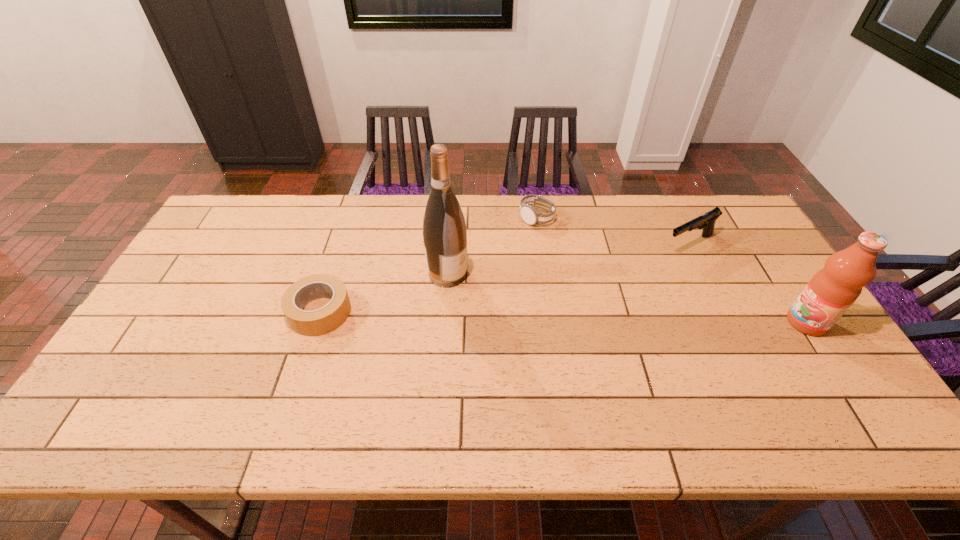
This screenshot has height=540, width=960. What are the coordinates of `vacant area situated at the edge of the leftmost object` in the screenshot? It's located at (166, 312).

Image resolution: width=960 pixels, height=540 pixels. Find the location of `vacant space located 0.150m at the edge of the leftmost object`. vacant space located 0.150m at the edge of the leftmost object is located at coordinates pos(231,312).

I want to click on free space located 0.360m at the edge of the leftmost object, so click(156, 312).

Image resolution: width=960 pixels, height=540 pixels. What are the coordinates of `vacant region located 0.350m on the front label of the second tallest object` in the screenshot? It's located at (659, 322).

The width and height of the screenshot is (960, 540). In order to click on vacant space located 0.180m on the front label of the second tallest object in this screenshot , I will do `click(721, 322)`.

The height and width of the screenshot is (540, 960). What are the coordinates of `free space located on the front label of the second tallest object` in the screenshot? It's located at (647, 322).

Locate an element on the screen. The width and height of the screenshot is (960, 540). vacant space situated on the label of the wine bottle is located at coordinates (530, 319).

Locate an element on the screen. The height and width of the screenshot is (540, 960). vacant space located 0.050m on the label of the wine bottle is located at coordinates pos(477,290).

At what (x,y) coordinates should I click in order to perform the action: click on vacant space situated 0.270m on the label of the wine bottle. Please return your answer as a coordinate pair (x, y). The height and width of the screenshot is (540, 960). Looking at the image, I should click on (543, 326).

This screenshot has width=960, height=540. I want to click on free space located on the face of the fourth tallest object, so click(x=558, y=271).